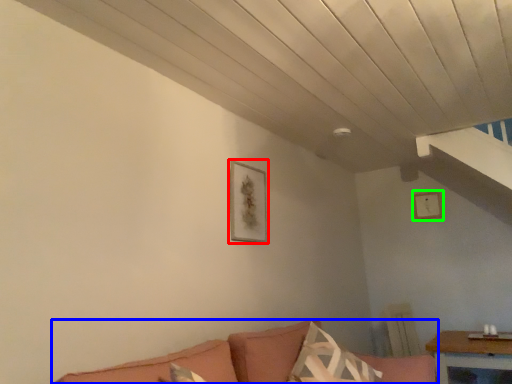
Question: Which is nearer to the picture frame (highlighted by a red box)? studio couch (highlighted by a blue box) or picture frame (highlighted by a green box).

Choices:
 (A) studio couch
 (B) picture frame

Answer: (A)